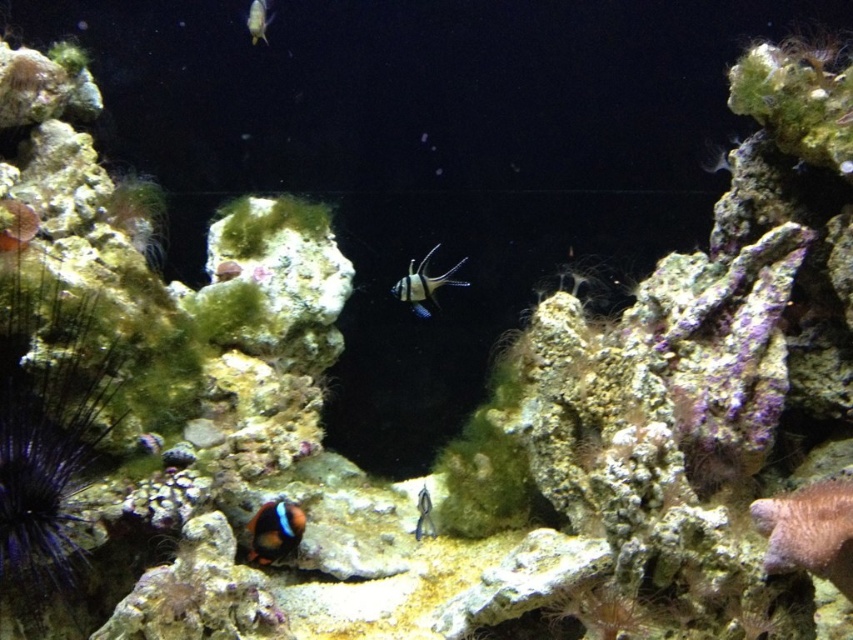
Is black glossy fish at center wider than translucent glass fish at upper center?

Correct, the width of black glossy fish at center exceeds that of translucent glass fish at upper center.

Identify the location of black glossy fish at center. (422, 284).

Where is `black glossy fish at center`? This screenshot has width=853, height=640. black glossy fish at center is located at coordinates (422, 284).

Does black glossy fish at center appear under translucent glass fish at center?

Actually, black glossy fish at center is above translucent glass fish at center.

Does black glossy fish at center appear over translucent glass fish at center?

Correct, black glossy fish at center is located above translucent glass fish at center.

What do you see at coordinates (422, 284) in the screenshot?
I see `black glossy fish at center` at bounding box center [422, 284].

Where is `black glossy fish at center`? black glossy fish at center is located at coordinates (422, 284).

Is orange and black clownfish at lower center bigger than translucent glass fish at upper center?

Yes, orange and black clownfish at lower center is bigger than translucent glass fish at upper center.

Identify the location of orange and black clownfish at lower center. (276, 531).